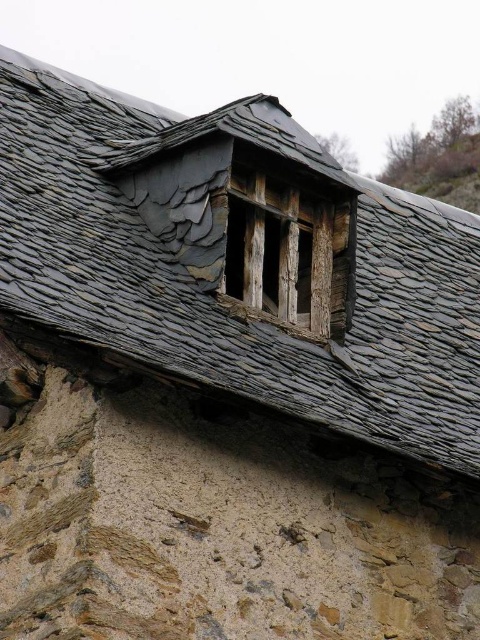
Between gray slate roof at center and weathered wood window at upper center, which one appears on the left side from the viewer's perspective?

Result: From the viewer's perspective, weathered wood window at upper center appears more on the left side.

Who is more distant from viewer, [63,134] or [289,317]?

The point [63,134] is behind.

Does point (178, 374) lie in front of point (321, 182)?

Yes, point (178, 374) is in front of point (321, 182).

The image size is (480, 640). Identify the location of gray slate roof at center. (240, 260).